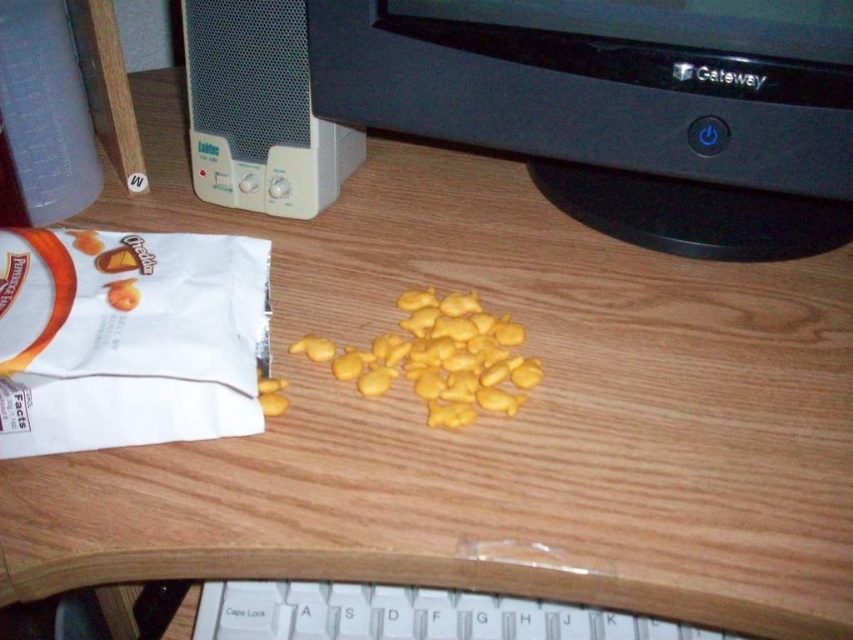
Question: Considering the relative positions of black plastic computer monitor at upper center and yellow matte snack at center in the image provided, where is black plastic computer monitor at upper center located with respect to yellow matte snack at center?

Choices:
 (A) below
 (B) above

Answer: (B)

Question: Which of the following is the farthest from the observer?

Choices:
 (A) white plastic keyboard at lower center
 (B) yellow matte snack at center
 (C) black plastic computer monitor at upper center

Answer: (A)

Question: Which point is closer to the camera taking this photo?

Choices:
 (A) (834, 88)
 (B) (303, 339)
 (C) (399, 608)

Answer: (A)

Question: Does black plastic computer monitor at upper center appear over yellow matte snack at center?

Choices:
 (A) no
 (B) yes

Answer: (B)

Question: Does black plastic computer monitor at upper center lie in front of white plastic keyboard at lower center?

Choices:
 (A) no
 (B) yes

Answer: (B)

Question: Which object is farther from the camera taking this photo?

Choices:
 (A) black plastic computer monitor at upper center
 (B) white plastic keyboard at lower center

Answer: (B)